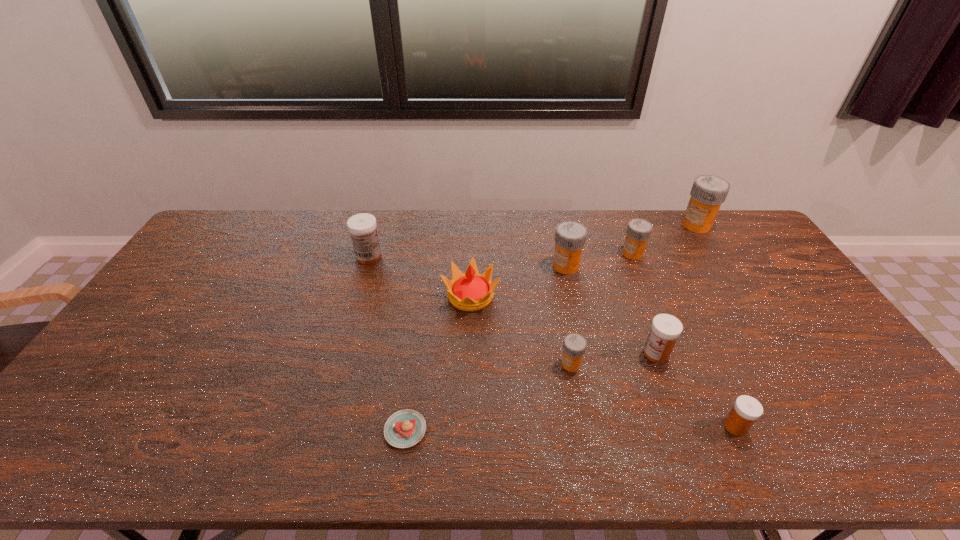
You are a GUI agent. You are given a task and a screenshot of the screen. Output one action in this format:
    pyautogui.click(x=<x>, y=<y>)
    Task: Click on the vacant space located 0.200m on the label side of the nearest orange medicine
    
    Given the screenshot: What is the action you would take?
    pyautogui.click(x=486, y=363)

This screenshot has width=960, height=540. Find the location of `vacant space situated 0.150m on the left of the pastry`. vacant space situated 0.150m on the left of the pastry is located at coordinates (322, 430).

The width and height of the screenshot is (960, 540). I want to click on medicine at the near edge, so click(x=746, y=410).

The width and height of the screenshot is (960, 540). Find the location of `pastry positioned at the near edge`. pastry positioned at the near edge is located at coordinates (405, 428).

Identify the location of object at the right edge. The image size is (960, 540). (708, 192).

Locate an element on the screen. The height and width of the screenshot is (540, 960). object present at the far right corner is located at coordinates (708, 192).

Locate an element on the screen. This screenshot has width=960, height=540. free location at the far edge is located at coordinates (467, 239).

Find the location of a particular element. vacant region at the near edge is located at coordinates (836, 447).

The height and width of the screenshot is (540, 960). I want to click on vacant area at the left edge, so click(168, 303).

You are a GUI agent. You are given a task and a screenshot of the screen. Output one action in this format:
    pyautogui.click(x=<x>, y=<y>)
    Task: Click on the vacant area at the right edge of the desktop
    The image size is (960, 540).
    Given the screenshot: What is the action you would take?
    pyautogui.click(x=835, y=337)